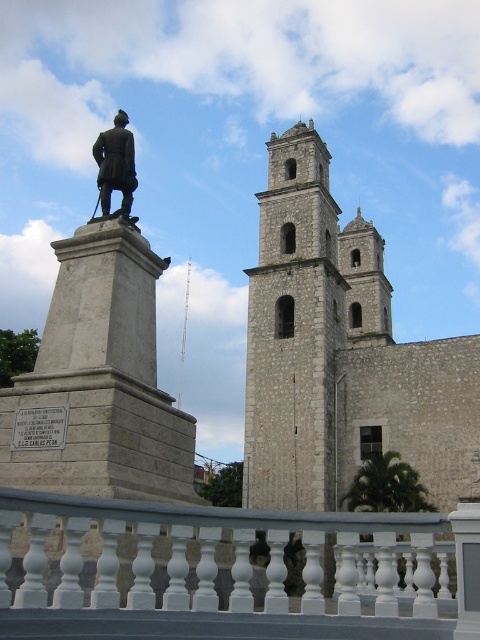
Can you confirm if white stone church at center is wider than polished bronze statue at center?

Indeed, white stone church at center has a greater width compared to polished bronze statue at center.

The width and height of the screenshot is (480, 640). I want to click on white stone church at center, so click(342, 355).

You are a GUI agent. You are given a task and a screenshot of the screen. Output one action in this format:
    pyautogui.click(x=<x>, y=<y>)
    Task: Click on the white painted wood railing at lower center
    The width and height of the screenshot is (480, 640).
    Given the screenshot: What is the action you would take?
    pyautogui.click(x=232, y=572)

Does white painted wood railing at lower center come in front of white stone church at center?

Yes, white painted wood railing at lower center is in front of white stone church at center.

Consider the image. Does white painted wood railing at lower center have a greater height compared to white stone church at center?

Incorrect, white painted wood railing at lower center's height is not larger of white stone church at center's.

Is point (400, 550) farther from viewer compared to point (360, 422)?

No.

Locate an element on the screen. The image size is (480, 640). white painted wood railing at lower center is located at coordinates (232, 572).